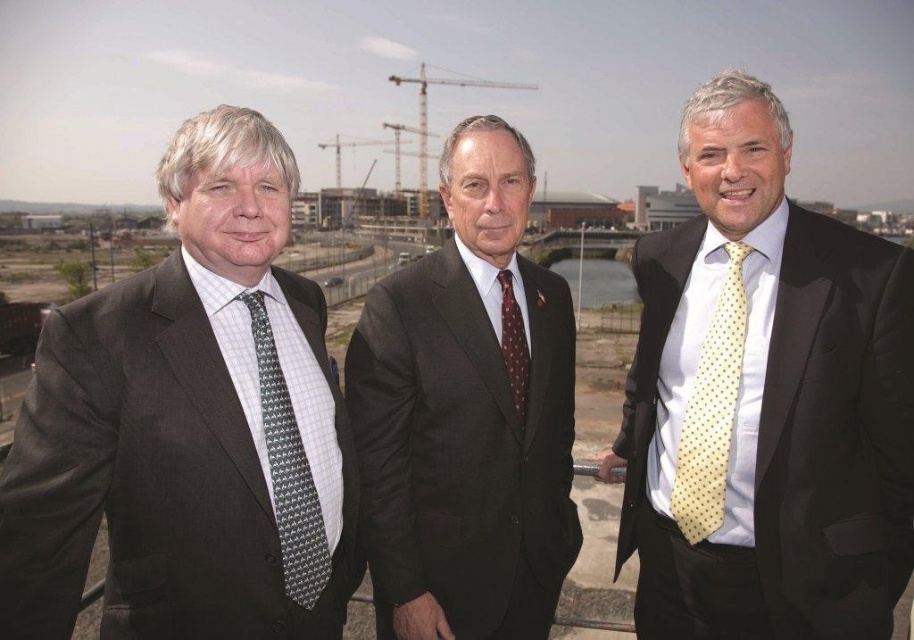
Question: In this image, where is dark brown suit at center located relative to gray printed tie at left?

Choices:
 (A) left
 (B) right

Answer: (B)

Question: Which is nearer to the dark gray suit at left?

Choices:
 (A) yellow dotted tie at center
 (B) maroon dotted tie at center

Answer: (B)

Question: Considering the real-world distances, which object is closest to the dark brown suit at center?

Choices:
 (A) gray printed tie at left
 (B) maroon dotted tie at center
 (C) dark gray suit at left

Answer: (B)

Question: Based on their relative distances, which object is nearer to the yellow dotted tie at center?

Choices:
 (A) dark brown suit at center
 (B) maroon dotted tie at center

Answer: (A)

Question: Where is dark gray suit at left located in relation to dark brown suit at center in the image?

Choices:
 (A) right
 (B) left

Answer: (B)

Question: Does yellow dotted tie at center appear on the right side of maroon dotted tie at center?

Choices:
 (A) yes
 (B) no

Answer: (A)